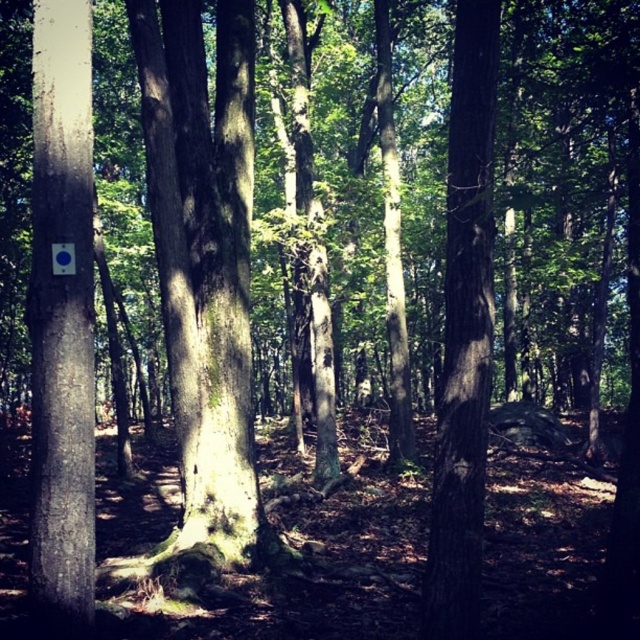
Consider the image. Is smooth gray bark at left positioned behind smooth brown tree trunk at center?

That is True.

From the picture: Which of these two, smooth gray bark at left or smooth brown tree trunk at center, stands taller?

smooth brown tree trunk at center

Is point (90, 284) positioned after point (435, 589)?

Yes, point (90, 284) is behind point (435, 589).

Find the location of a particular element. Image resolution: width=640 pixels, height=640 pixels. smooth gray bark at left is located at coordinates (61, 316).